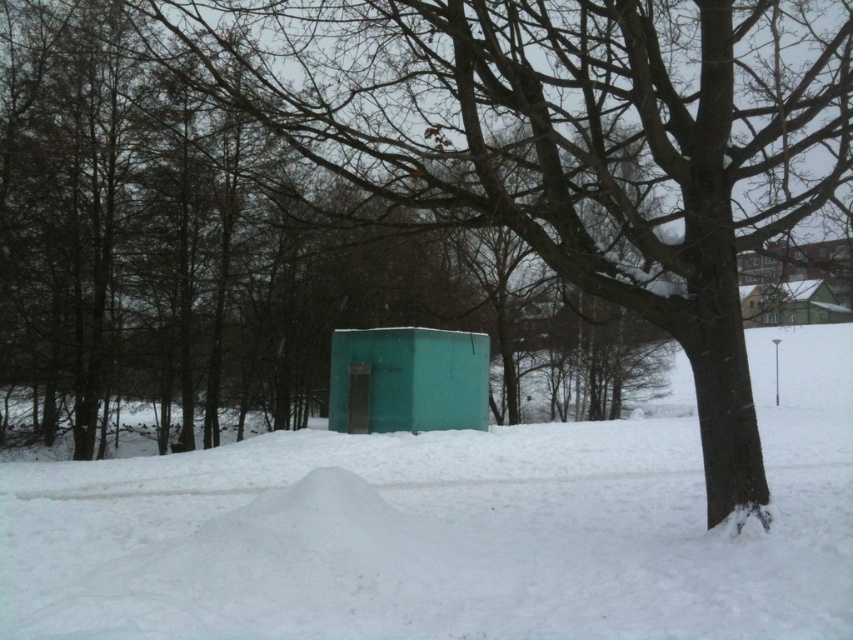
You are standing at the base of the snowy mound in the foreground and want to walk to the teal shed in the midground. There are two points marked on your path. Which point, point (668,516) or point (445,397), is closer to you as you start walking towards the shed?

Point (668,516) is closer to you than point (445,397) because it is nearer to the viewer.

You are a delivery person trying to park your 2.5 meter wide delivery truck between the green matte shelter at center and the green matte shed at upper right. Based on the scene, can you fit your truck there?

The green matte shelter at center is thinner than the green matte shed at upper right. However, the description does not provide exact measurements of the distance between them. Without knowing the actual space available, it is impossible to determine if the 2.5 meter wide truck can fit. Additional information about the separation between the two structures is needed to make an accurate assessment.

You are standing at point A and want to reach point B. The coordinates of point A are (x=419, y=346). The coordinates of point B are 0.623, 0.312. The distance between them is 19.10 meters. What is the shortest path you can take to reach point B from point A without crossing any obstacles?

The shortest path between point A and point B is a straight line, which is 19.10 meters long. Since there are no obstacles mentioned in the scene description, you can move directly from point A to point B in a straight line.